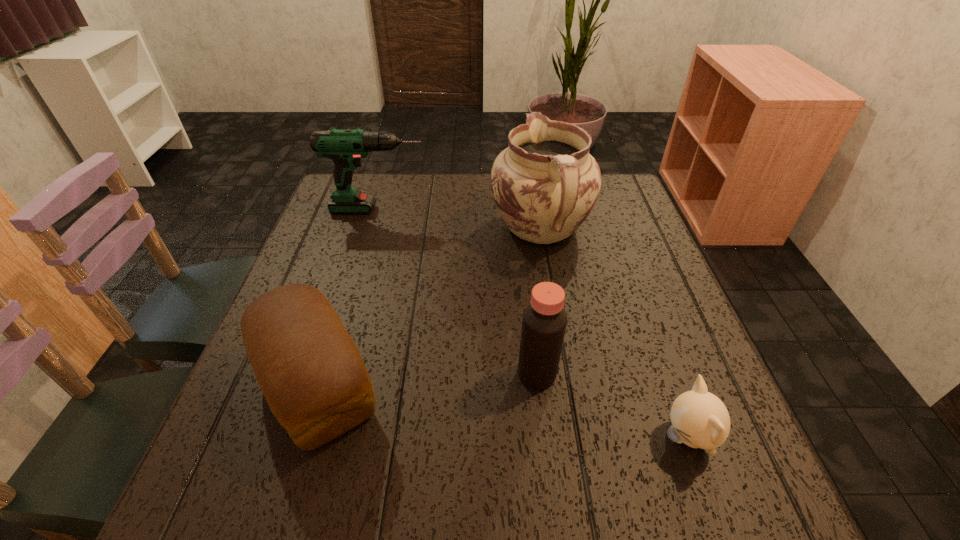
I want to click on vacant space that satisfies the following two spatial constraints: 1. on the back side of the fourth tallest object; 2. on the left side of the vinegar, so (322, 374).

Where is `free space in the image that satisfies the following two spatial constraints: 1. on the handle side of the vinegar; 2. on the right side of the drill`? free space in the image that satisfies the following two spatial constraints: 1. on the handle side of the vinegar; 2. on the right side of the drill is located at coordinates (330, 374).

In order to click on vacant space that satisfies the following two spatial constraints: 1. on the handle side of the vinegar; 2. on the right side of the drill in this screenshot , I will do `click(330, 374)`.